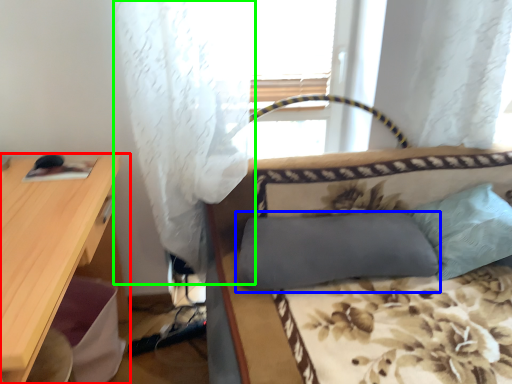
Question: Which object is the farthest from desk (highlighted by a red box)? Choose among these: pillow (highlighted by a blue box) or curtain (highlighted by a green box).

Choices:
 (A) pillow
 (B) curtain

Answer: (A)